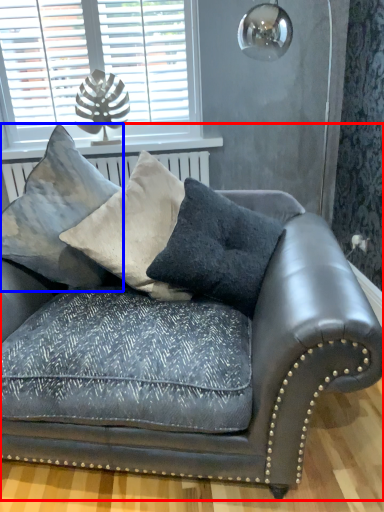
Question: Which object appears closest to the camera in this image, studio couch (highlighted by a red box) or pillow (highlighted by a blue box)?

Choices:
 (A) studio couch
 (B) pillow

Answer: (A)